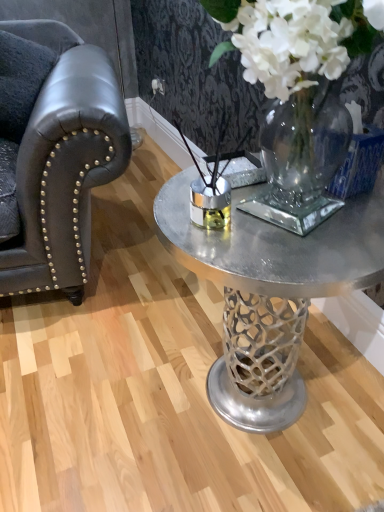
Question: In terms of size, does clear glass vase at center appear bigger or smaller than metallic silver coffee table at center?

Choices:
 (A) big
 (B) small

Answer: (A)

Question: Considering their positions, is clear glass vase at center located in front of or behind metallic silver coffee table at center?

Choices:
 (A) behind
 (B) front

Answer: (B)

Question: Considering the real-world distances, which object is closest to the matte black leather armchair at left?

Choices:
 (A) metallic silver coffee table at center
 (B) clear glass vase at center
 (C) dark leather armrest at left

Answer: (C)

Question: Estimate the real-world distances between objects in this image. Which object is closer to the clear glass vase at center?

Choices:
 (A) metallic silver coffee table at center
 (B) matte black leather armchair at left
 (C) dark leather armrest at left

Answer: (A)